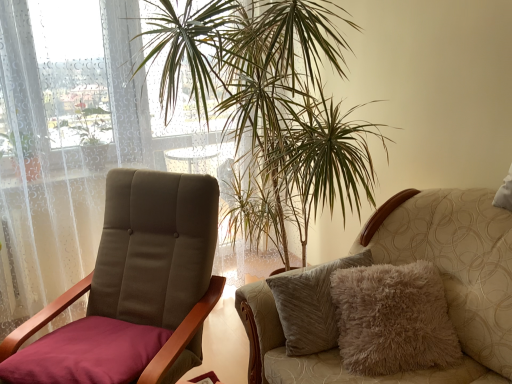
Question: Considering the relative sizes of fuzzy beige cushion at right, which appears as the 1th chair when viewed from the right, and velvet maroon chair at left, which appears as the first chair when viewed from the left, in the image provided, is fuzzy beige cushion at right, which appears as the 1th chair when viewed from the right, smaller than velvet maroon chair at left, which appears as the first chair when viewed from the left,?

Choices:
 (A) yes
 (B) no

Answer: (B)

Question: From the image's perspective, does fuzzy beige cushion at right, which appears as the 1th chair when viewed from the right, appear lower than velvet maroon chair at left, which appears as the first chair when viewed from the left?

Choices:
 (A) yes
 (B) no

Answer: (A)

Question: Is fuzzy beige cushion at right, the second chair from the left, to the right of velvet maroon chair at left, which appears as the first chair when viewed from the left, from the viewer's perspective?

Choices:
 (A) yes
 (B) no

Answer: (A)

Question: Does fuzzy beige cushion at right, the second chair from the left, have a lesser width compared to velvet maroon chair at left, which appears as the first chair when viewed from the left?

Choices:
 (A) yes
 (B) no

Answer: (B)

Question: Can velvet maroon chair at left, the 2th chair viewed from the right, be found inside fuzzy beige cushion at right, the second chair from the left?

Choices:
 (A) no
 (B) yes

Answer: (A)

Question: Considering the relative positions of fuzzy beige cushion at right, the second chair from the left, and velvet maroon chair at left, which appears as the first chair when viewed from the left, in the image provided, is fuzzy beige cushion at right, the second chair from the left, behind velvet maroon chair at left, which appears as the first chair when viewed from the left,?

Choices:
 (A) no
 (B) yes

Answer: (A)

Question: Are velvet maroon chair at left, which appears as the first chair when viewed from the left, and green leafy plant at center far apart?

Choices:
 (A) yes
 (B) no

Answer: (B)

Question: Is velvet maroon chair at left, the 2th chair viewed from the right, behind green leafy plant at center?

Choices:
 (A) no
 (B) yes

Answer: (A)

Question: Could you tell me if velvet maroon chair at left, which appears as the first chair when viewed from the left, is facing green leafy plant at center?

Choices:
 (A) yes
 (B) no

Answer: (B)

Question: Is velvet maroon chair at left, the 2th chair viewed from the right, to the left of green leafy plant at center from the viewer's perspective?

Choices:
 (A) no
 (B) yes

Answer: (B)

Question: From a real-world perspective, does velvet maroon chair at left, the 2th chair viewed from the right, sit lower than green leafy plant at center?

Choices:
 (A) yes
 (B) no

Answer: (A)

Question: Can you confirm if velvet maroon chair at left, which appears as the first chair when viewed from the left, is positioned to the right of green leafy plant at center?

Choices:
 (A) yes
 (B) no

Answer: (B)

Question: Is fuzzy beige cushion at right, which appears as the 1th chair when viewed from the right, a part of velvet maroon chair at left, which appears as the first chair when viewed from the left?

Choices:
 (A) yes
 (B) no

Answer: (B)